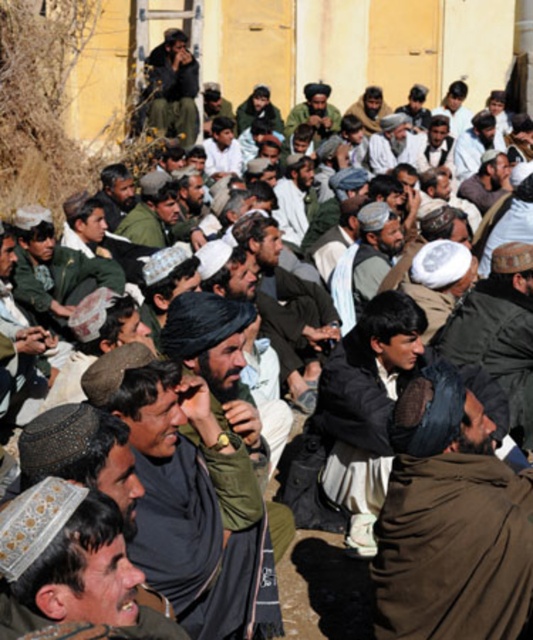
You are a photographer trying to capture a closeup of the dark brown fabric headscarf at center. However, the brown woolen jacket at center is blocking your view. Can you adjust your position to get a clear shot without moving the jacket?

The dark brown fabric headscarf at center is in front of the brown woolen jacket at center, so you can already see it clearly without needing to adjust your position.

You are a photographer trying to capture a closeup of the brown woolen turban at center and the dark brown fabric headscarf at center. If your camera can only focus on objects wider than 15 cm, will both items be in focus?

The brown woolen turban at center is narrower than the dark brown fabric headscarf at center. Since the camera requires objects wider than 15 cm to focus, only the dark brown fabric headscarf at center may be in focus if it meets the width requirement, but the brown woolen turban at center might not be wide enough.

You are a photographer trying to capture a closeup of the dark brown fabric headscarf at center and the brown woolen jacket at center. Which object should you focus on first if you want to ensure both are in focus without moving the camera?

The dark brown fabric headscarf at center is below the brown woolen jacket at center, so you should focus on the brown woolen jacket at center first as it is closer to the camera. This way, the headscarf will also be in focus due to the depth of field.